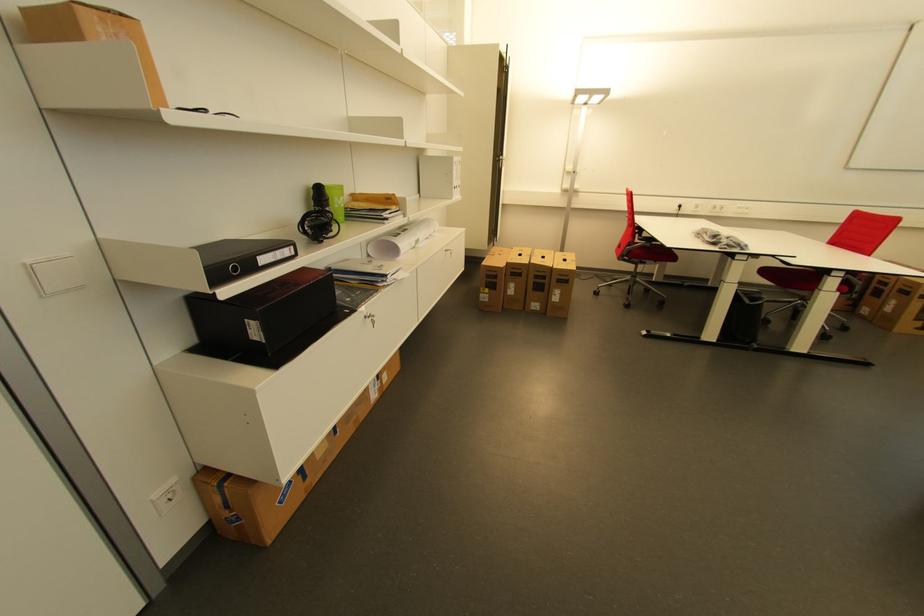
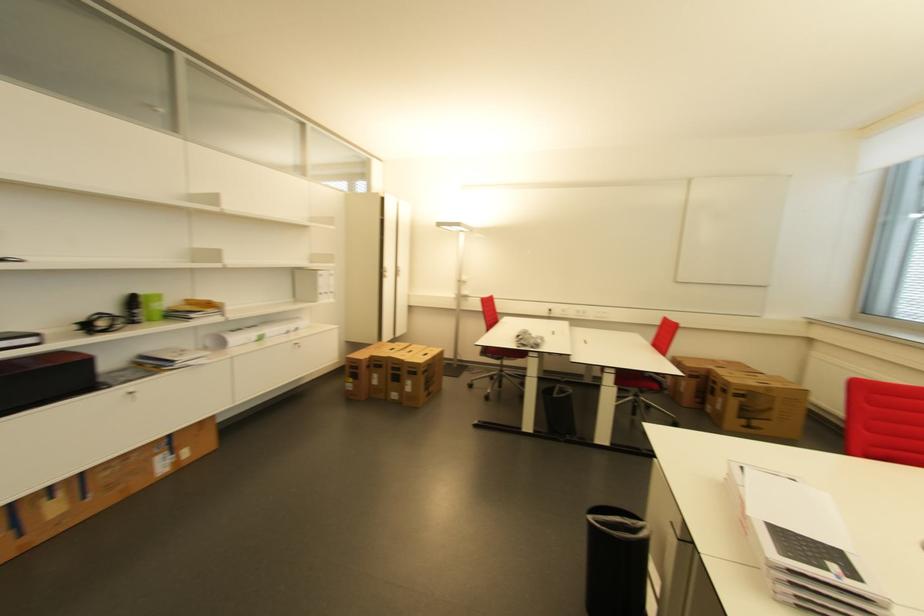
Question: The images are taken continuously from a first-person perspective. In which direction are you moving?

Choices:
 (A) Left
 (B) Right
 (C) Forward
 (D) Backward

Answer: (B)